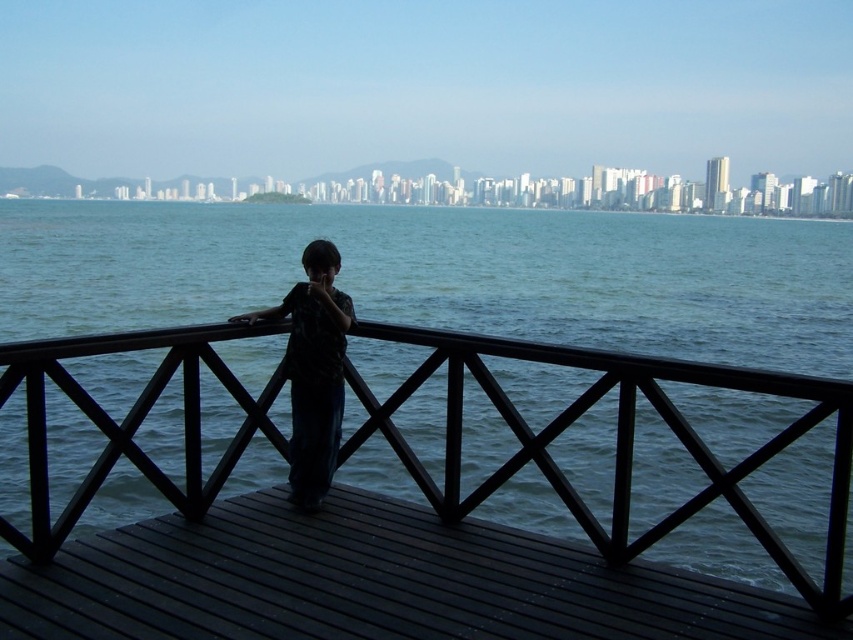
Who is more forward, [482,627] or [302,472]?

Point [482,627] is more forward.

Measure the distance between black wood dock at center and camera.

A distance of 3.97 meters exists between black wood dock at center and camera.

Between point (123, 589) and point (291, 296), which one is positioned behind?

The point (291, 296) is behind.

The height and width of the screenshot is (640, 853). I want to click on black wood dock at center, so click(x=370, y=582).

Is blue water at center smaller than black wood dock at center?

No.

Find the location of a particular element. blue water at center is located at coordinates (445, 275).

The width and height of the screenshot is (853, 640). What are the coordinates of `blue water at center` in the screenshot? It's located at (445, 275).

Can you confirm if blue water at center is thinner than dark fabric shirt at center?

No.

Between point (64, 305) and point (332, 412), which one is positioned behind?

Point (64, 305)

Is point (368, 342) farther from camera compared to point (311, 324)?

Yes, it is behind point (311, 324).

Image resolution: width=853 pixels, height=640 pixels. Find the location of `blue water at center`. blue water at center is located at coordinates (445, 275).